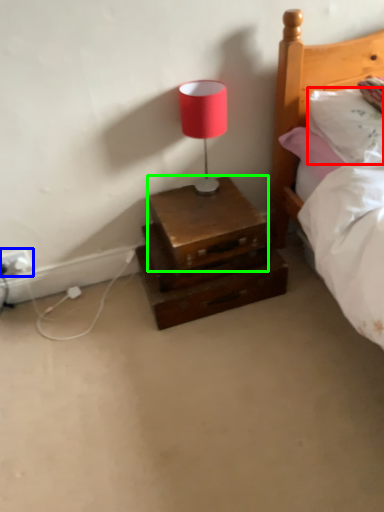
Question: Which is nearer to the pillow (highlighted by a red box)? electric outlet (highlighted by a blue box) or chest (highlighted by a green box).

Choices:
 (A) electric outlet
 (B) chest

Answer: (B)